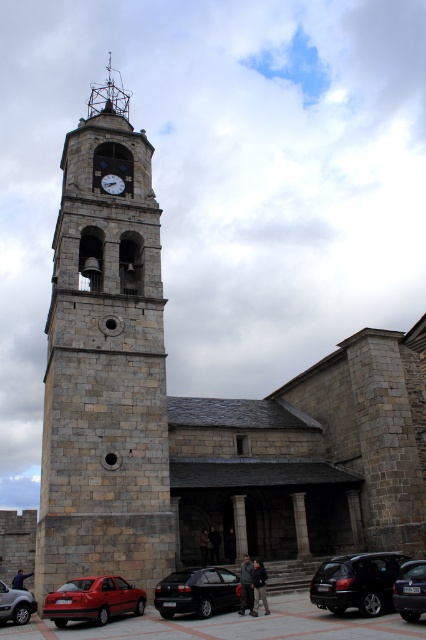
Question: Which point is farther to the camera?

Choices:
 (A) (106, 176)
 (B) (414, 621)
 (C) (345, 582)

Answer: (A)

Question: Does shiny black suv at lower right have a larger size compared to matte red sedan at lower left?

Choices:
 (A) no
 (B) yes

Answer: (B)

Question: Based on their relative distances, which object is nearer to the matte gray clock at center?

Choices:
 (A) matte black sedan at lower left
 (B) matte red sedan at lower left

Answer: (A)

Question: Is stone clock tower at center closer to camera compared to matte black sedan at lower left?

Choices:
 (A) yes
 (B) no

Answer: (B)

Question: Can you confirm if shiny black hatchback at lower center is bigger than dark gray metallic van at center?

Choices:
 (A) no
 (B) yes

Answer: (A)

Question: Which point appears closest to the camera in this image?

Choices:
 (A) (319, 580)
 (B) (118, 177)
 (C) (164, 596)
 (D) (115, 253)

Answer: (A)